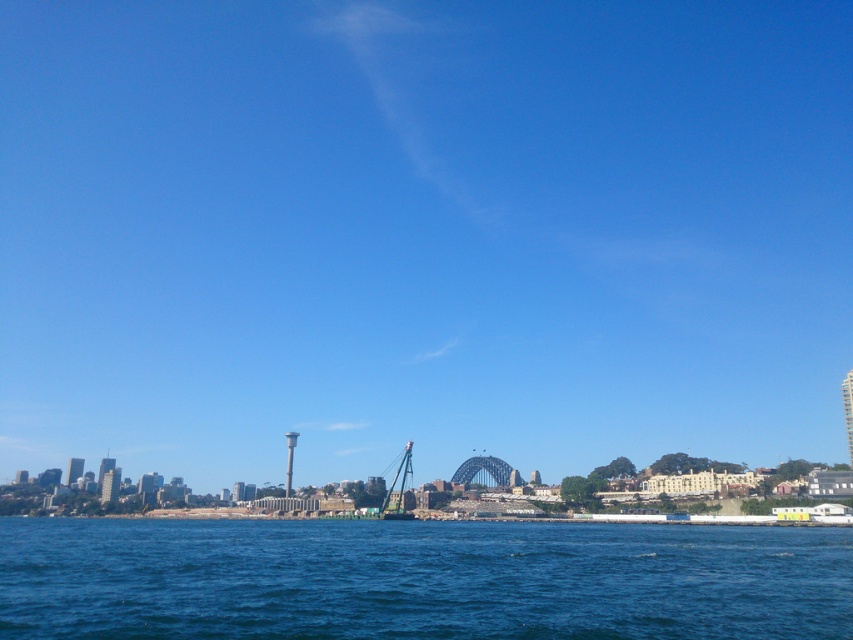
Question: Is blue liquid water at lower center positioned before metallic gray crane at center?

Choices:
 (A) yes
 (B) no

Answer: (A)

Question: Can you confirm if blue liquid water at lower center is smaller than metallic gray crane at center?

Choices:
 (A) no
 (B) yes

Answer: (A)

Question: Does blue liquid water at lower center have a lesser width compared to metallic gray crane at center?

Choices:
 (A) yes
 (B) no

Answer: (B)

Question: Which point appears farthest from the camera in this image?

Choices:
 (A) (62, 518)
 (B) (410, 456)

Answer: (A)